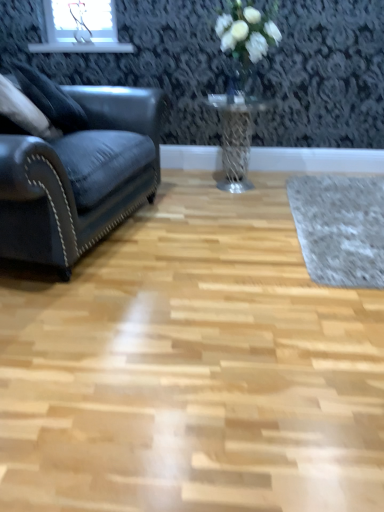
Question: In terms of width, does clear glass vase at upper center look wider or thinner when compared to white matte vase at upper center?

Choices:
 (A) wide
 (B) thin

Answer: (B)

Question: Choose the correct answer: Is clear glass vase at upper center inside white matte vase at upper center or outside it?

Choices:
 (A) outside
 (B) inside

Answer: (B)

Question: Estimate the real-world distances between objects in this image. Which object is closer to the white matte vase at upper center?

Choices:
 (A) velvet dark blue couch at left
 (B) metallic mesh table at center
 (C) light wood floor at center
 (D) suede-like dark blue pillow at left
 (E) gray woolen mat at right

Answer: (B)

Question: Considering the real-world distances, which object is closest to the clear glass vase at upper center?

Choices:
 (A) light wood floor at center
 (B) gray woolen mat at right
 (C) suede-like dark blue pillow at left
 (D) velvet dark blue couch at left
 (E) metallic mesh table at center

Answer: (E)